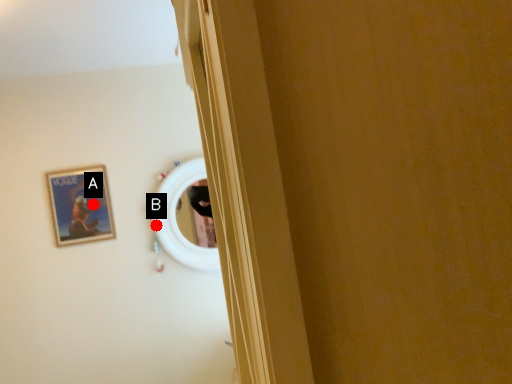
Question: Two points are circled on the image, labeled by A and B beside each circle. Which point is closer to the camera?

Choices:
 (A) A is closer
 (B) B is closer

Answer: (A)